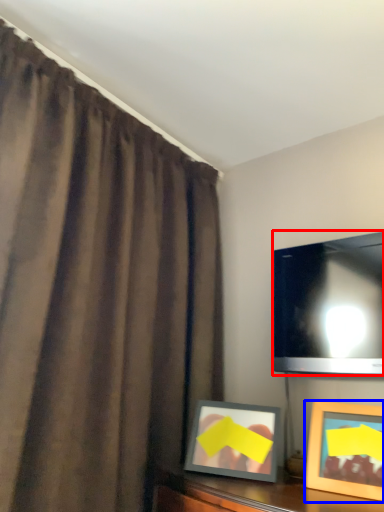
Question: Among these objects, which one is nearest to the camera, television (highlighted by a red box) or picture frame (highlighted by a blue box)?

Choices:
 (A) television
 (B) picture frame

Answer: (B)